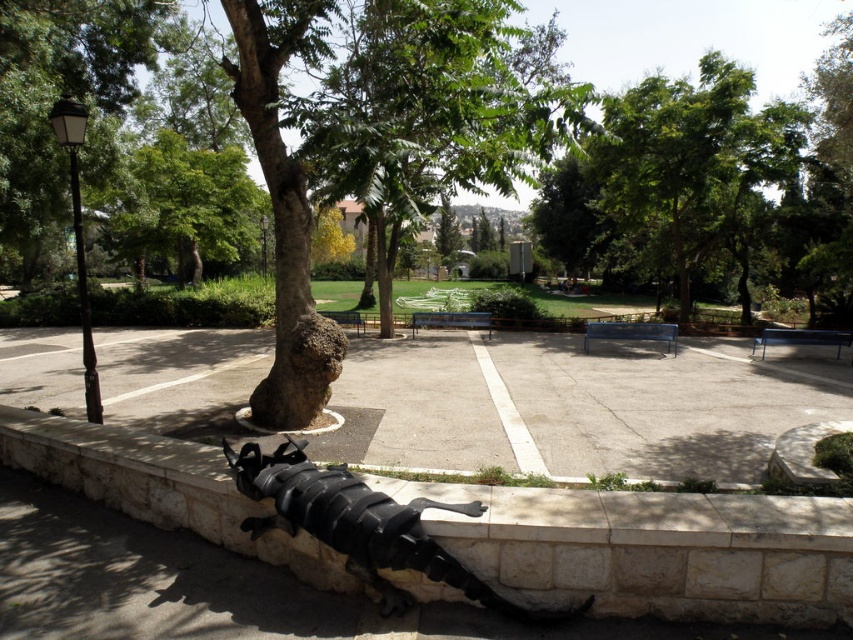
Question: Is black stone curb at lower center below green leafy tree at center?

Choices:
 (A) no
 (B) yes

Answer: (B)

Question: Can you confirm if green leafy tree at center is smaller than black matte sculpture at lower center?

Choices:
 (A) yes
 (B) no

Answer: (B)

Question: Among these points, which one is farthest from the camera?

Choices:
 (A) (15, 208)
 (B) (318, 545)
 (C) (181, 230)

Answer: (C)

Question: Can you confirm if green leafy tree at center is positioned to the right of green leafy tree at left?

Choices:
 (A) yes
 (B) no

Answer: (A)

Question: Which object is positioned closest to the green leafy tree at upper right?

Choices:
 (A) green leafy tree at center
 (B) black stone curb at lower center
 (C) black matte sculpture at lower center

Answer: (A)

Question: Which point is closer to the camera taking this photo?

Choices:
 (A) (489, 593)
 (B) (241, 177)

Answer: (A)